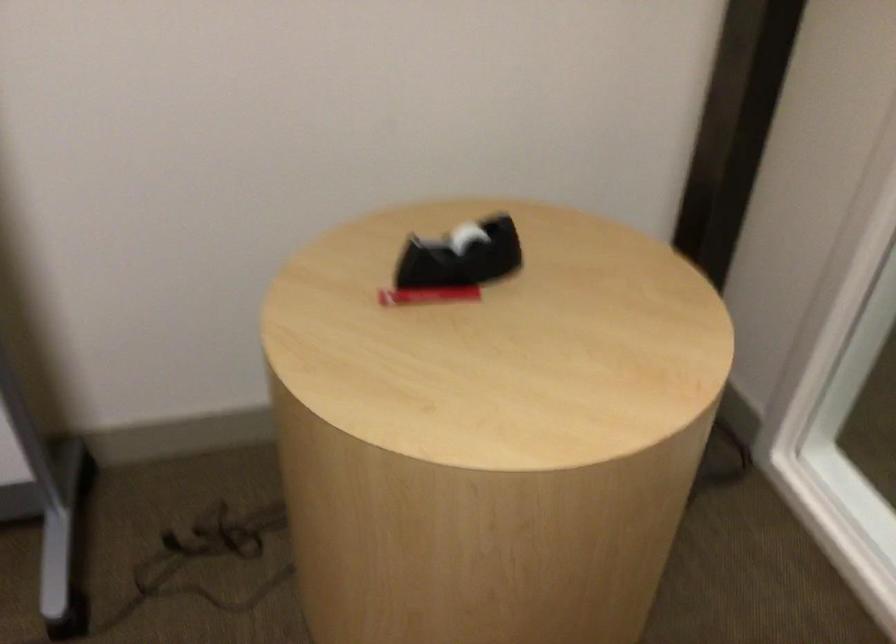
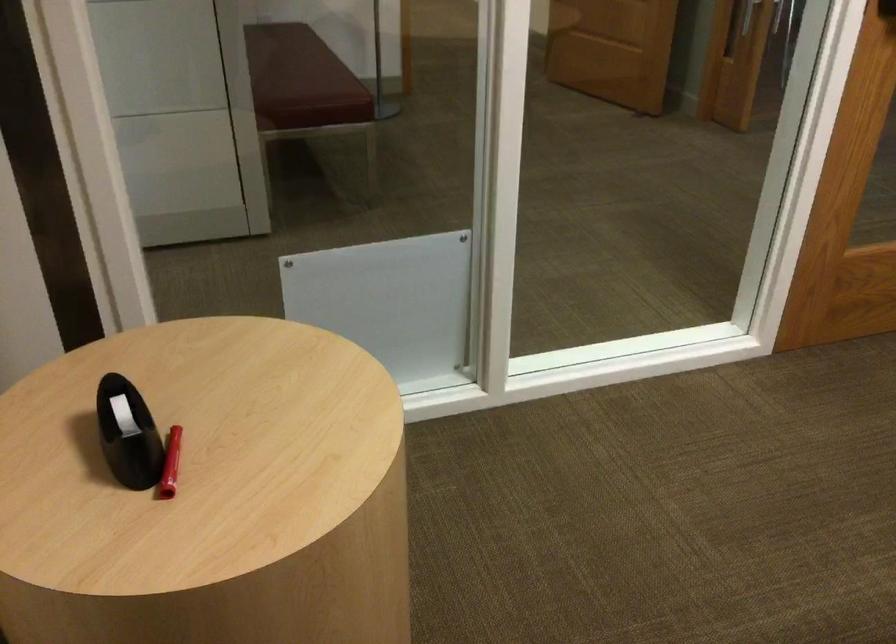
Find the pixel in the second image that matches the point at 418,240 in the first image.

(127, 433)